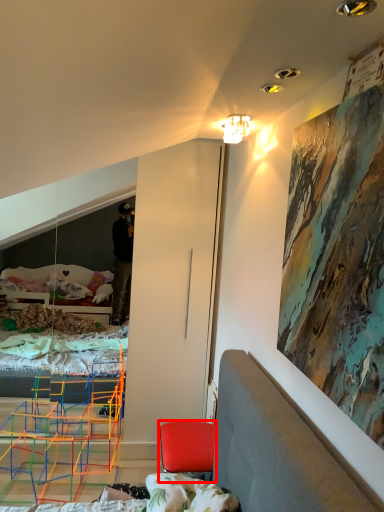
Question: Observing the image, what is the correct spatial positioning of chair (annotated by the red box) in reference to lamp?

Choices:
 (A) left
 (B) right

Answer: (A)